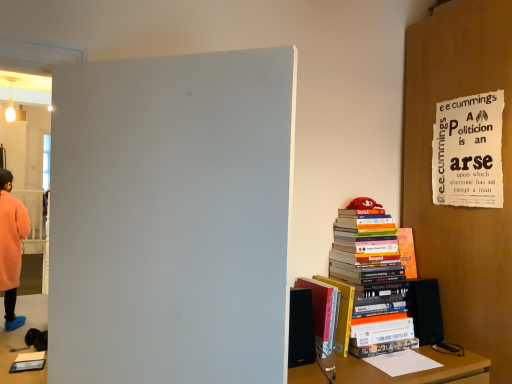
Question: Is hardcover book at right, which appears as the 2th book when viewed from the right, positioned before ripped paper poster at upper right?

Choices:
 (A) no
 (B) yes

Answer: (A)

Question: Is hardcover book at right, which appears as the 2th book when viewed from the right, outside of ripped paper poster at upper right?

Choices:
 (A) yes
 (B) no

Answer: (A)

Question: Can you confirm if hardcover book at right, which appears as the 2th book when viewed from the right, is wider than ripped paper poster at upper right?

Choices:
 (A) no
 (B) yes

Answer: (B)

Question: Is hardcover book at right, which appears as the 2th book when viewed from the right, behind ripped paper poster at upper right?

Choices:
 (A) yes
 (B) no

Answer: (A)

Question: From the image's perspective, is hardcover book at right, placed as the first book when sorted from left to right, on ripped paper poster at upper right?

Choices:
 (A) yes
 (B) no

Answer: (B)

Question: Considering the relative positions of hardcover book at right, which appears as the 2th book when viewed from the right, and ripped paper poster at upper right in the image provided, is hardcover book at right, which appears as the 2th book when viewed from the right, to the left or to the right of ripped paper poster at upper right?

Choices:
 (A) left
 (B) right

Answer: (A)

Question: From a real-world perspective, is hardcover book at right, which appears as the 2th book when viewed from the right, positioned above or below ripped paper poster at upper right?

Choices:
 (A) above
 (B) below

Answer: (B)

Question: Is hardcover book at right, which appears as the 2th book when viewed from the right, wider or thinner than ripped paper poster at upper right?

Choices:
 (A) wide
 (B) thin

Answer: (A)

Question: Which is correct: hardcover book at right, which appears as the 2th book when viewed from the right, is inside ripped paper poster at upper right, or outside of it?

Choices:
 (A) inside
 (B) outside

Answer: (B)

Question: Choose the correct answer: Is fluffy pink coat at left inside hardcover book at right, which appears as the 2th book when viewed from the right, or outside it?

Choices:
 (A) outside
 (B) inside

Answer: (A)

Question: Is fluffy pink coat at left wider or thinner than hardcover book at right, which appears as the 2th book when viewed from the right?

Choices:
 (A) wide
 (B) thin

Answer: (A)

Question: In terms of size, does fluffy pink coat at left appear bigger or smaller than hardcover book at right, placed as the first book when sorted from left to right?

Choices:
 (A) big
 (B) small

Answer: (A)

Question: Considering the positions of point (18, 259) and point (328, 307), is point (18, 259) closer or farther from the camera than point (328, 307)?

Choices:
 (A) farther
 (B) closer

Answer: (A)

Question: Is point (6, 306) closer or farther from the camera than point (446, 110)?

Choices:
 (A) farther
 (B) closer

Answer: (A)

Question: Considering the positions of fluffy pink coat at left and ripped paper poster at upper right in the image, is fluffy pink coat at left wider or thinner than ripped paper poster at upper right?

Choices:
 (A) wide
 (B) thin

Answer: (A)